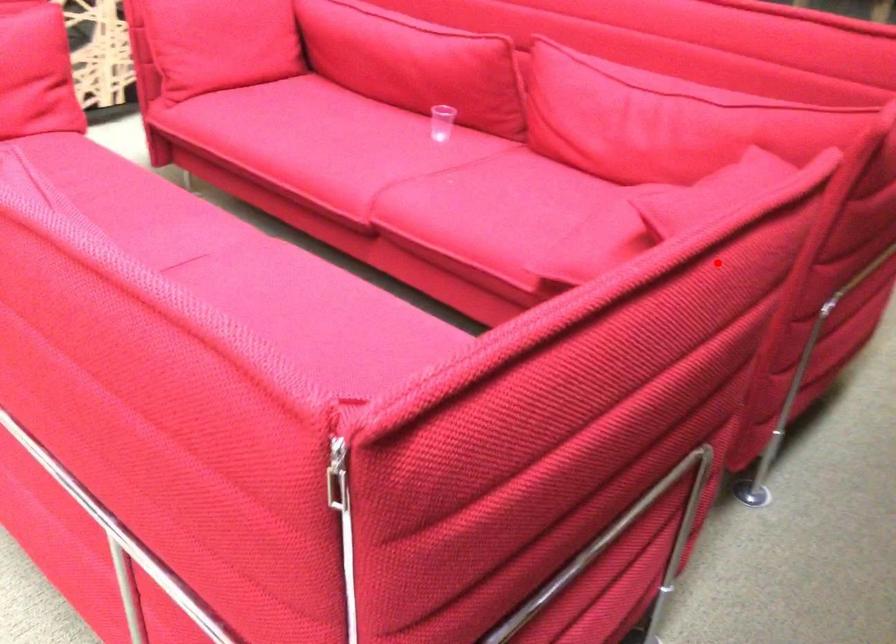
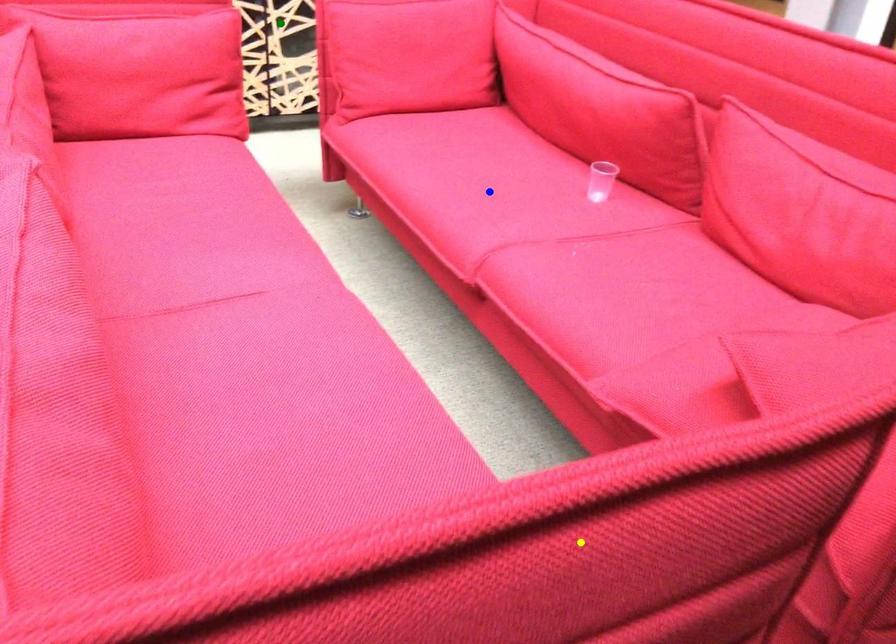
Question: I am providing you with two images of the same scene from different viewpoints. A red point is marked on the first image. You are given multiple points on the second image. Which point in image 2 represents the same 3d spot as the red point in image 1?

Choices:
 (A) green point
 (B) blue point
 (C) yellow point

Answer: (C)